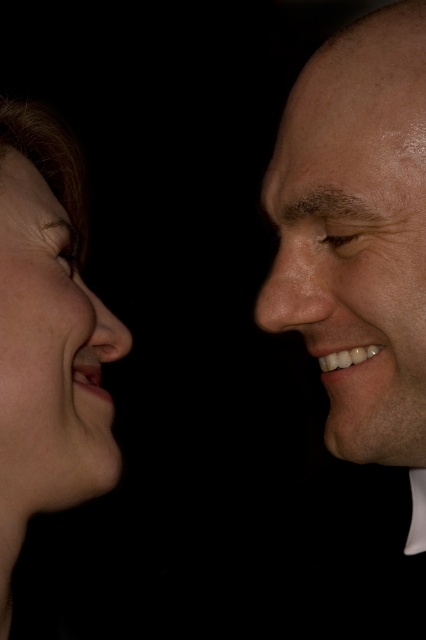
Question: Does smooth skin face at right appear on the left side of matte skin face at left?

Choices:
 (A) yes
 (B) no

Answer: (B)

Question: Which object is positioned farthest from the smooth skin nose at center?

Choices:
 (A) shiny skin forehead at upper right
 (B) matte skin nose at center

Answer: (B)

Question: Which object appears farthest from the camera in this image?

Choices:
 (A) smooth skin nose at center
 (B) matte skin face at left
 (C) smooth skin face at right
 (D) shiny skin forehead at upper right

Answer: (A)

Question: Which of the following is the farthest from the observer?

Choices:
 (A) matte skin nose at center
 (B) smooth skin face at right

Answer: (A)

Question: Does smooth skin face at right appear over smooth skin nose at center?

Choices:
 (A) yes
 (B) no

Answer: (B)

Question: Is the position of smooth skin face at right less distant than that of smooth skin nose at center?

Choices:
 (A) yes
 (B) no

Answer: (A)